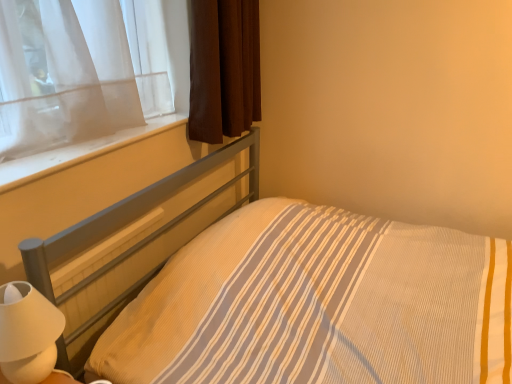
Question: Does brown fabric curtain at upper left appear on the left side of yellow striped fabric at center?

Choices:
 (A) yes
 (B) no

Answer: (A)

Question: Is brown fabric curtain at upper left oriented towards yellow striped fabric at center?

Choices:
 (A) yes
 (B) no

Answer: (B)

Question: Is brown fabric curtain at upper left positioned with its back to yellow striped fabric at center?

Choices:
 (A) yes
 (B) no

Answer: (B)

Question: Does brown fabric curtain at upper left touch yellow striped fabric at center?

Choices:
 (A) yes
 (B) no

Answer: (B)

Question: Can you confirm if brown fabric curtain at upper left is bigger than yellow striped fabric at center?

Choices:
 (A) yes
 (B) no

Answer: (B)

Question: Considering the relative sizes of brown fabric curtain at upper left and yellow striped fabric at center in the image provided, is brown fabric curtain at upper left taller than yellow striped fabric at center?

Choices:
 (A) no
 (B) yes

Answer: (A)

Question: Does brown fabric curtain at upper left lie behind white matte table lamp at lower left?

Choices:
 (A) no
 (B) yes

Answer: (B)

Question: Considering the relative sizes of brown fabric curtain at upper left and white matte table lamp at lower left in the image provided, is brown fabric curtain at upper left wider than white matte table lamp at lower left?

Choices:
 (A) yes
 (B) no

Answer: (A)

Question: Considering the relative sizes of brown fabric curtain at upper left and white matte table lamp at lower left in the image provided, is brown fabric curtain at upper left thinner than white matte table lamp at lower left?

Choices:
 (A) yes
 (B) no

Answer: (B)

Question: Can you confirm if brown fabric curtain at upper left is taller than white matte table lamp at lower left?

Choices:
 (A) no
 (B) yes

Answer: (B)

Question: From the image's perspective, is brown fabric curtain at upper left on top of white matte table lamp at lower left?

Choices:
 (A) no
 (B) yes

Answer: (B)

Question: From a real-world perspective, is brown fabric curtain at upper left beneath white matte table lamp at lower left?

Choices:
 (A) yes
 (B) no

Answer: (B)

Question: Would you say white smooth window sill at upper left contains brown fabric curtain at upper left?

Choices:
 (A) no
 (B) yes

Answer: (A)